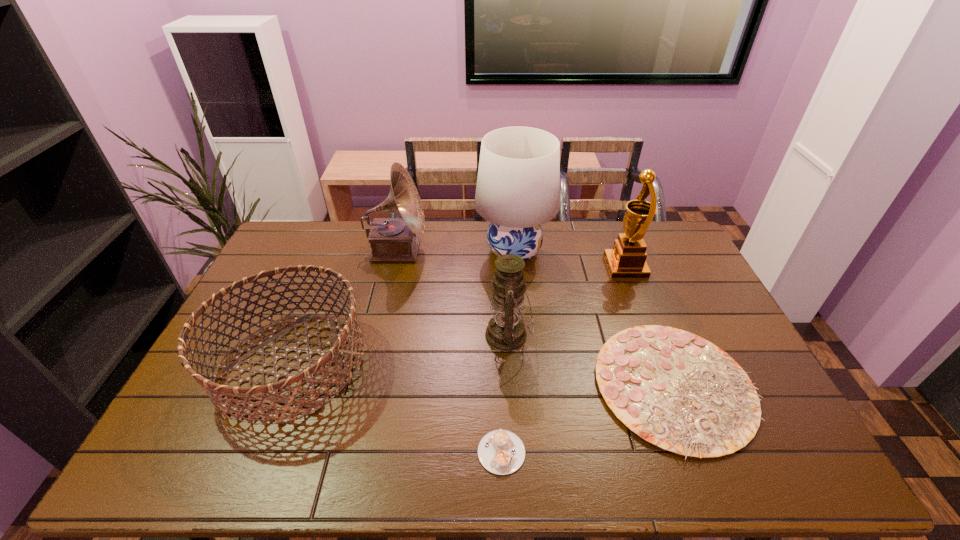
Identify the location of phonograph record at the far edge. This screenshot has height=540, width=960. (391, 239).

I want to click on pizza at the near edge, so click(x=676, y=390).

Identify the location of cappuccino at the near edge. Image resolution: width=960 pixels, height=540 pixels. (501, 452).

Where is `object at the left edge`? Image resolution: width=960 pixels, height=540 pixels. object at the left edge is located at coordinates (338, 340).

You are a GUI agent. You are given a task and a screenshot of the screen. Output one action in this format:
    pyautogui.click(x=<x>, y=<y>)
    Task: Click on the object located in the right edge section of the desktop
    This screenshot has width=960, height=540.
    Given the screenshot: What is the action you would take?
    pyautogui.click(x=676, y=390)

You are a GUI agent. You are given a task and a screenshot of the screen. Output one action in this format:
    pyautogui.click(x=<x>, y=<y>)
    Task: Click on the object at the near right corner
    This screenshot has width=960, height=540.
    Given the screenshot: What is the action you would take?
    pyautogui.click(x=676, y=390)

This screenshot has height=540, width=960. I want to click on free space at the far edge, so click(616, 227).

What are the coordinates of `vacant space at the near edge of the desktop` in the screenshot? It's located at (458, 451).

Locate an element on the screen. This screenshot has width=960, height=540. free space at the right edge of the desktop is located at coordinates (672, 298).

Where is `vacant space at the far right corner of the desktop`? Image resolution: width=960 pixels, height=540 pixels. vacant space at the far right corner of the desktop is located at coordinates (652, 258).